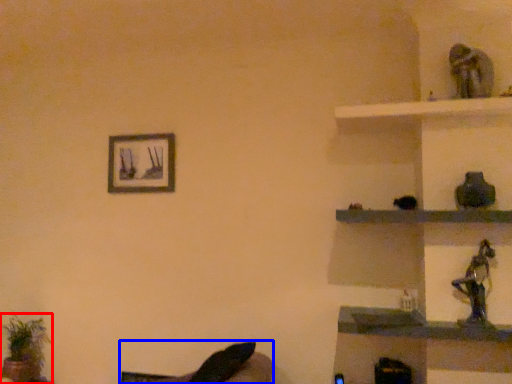
Question: Which of the following is the closest to the observer, houseplant (highlighted by a red box) or swivel chair (highlighted by a blue box)?

Choices:
 (A) houseplant
 (B) swivel chair

Answer: (B)